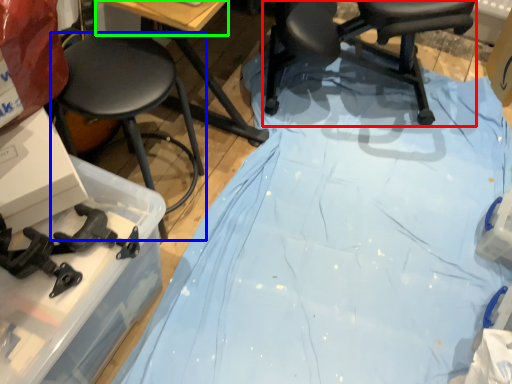
Question: Which is nearer to the chair (highlighted by a red box)? stool (highlighted by a blue box) or table top (highlighted by a green box).

Choices:
 (A) stool
 (B) table top

Answer: (B)